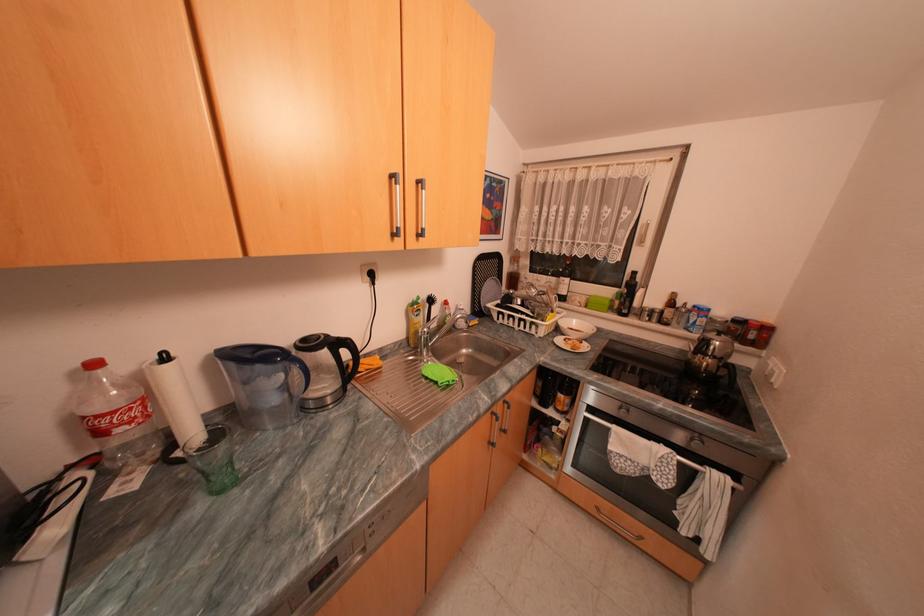
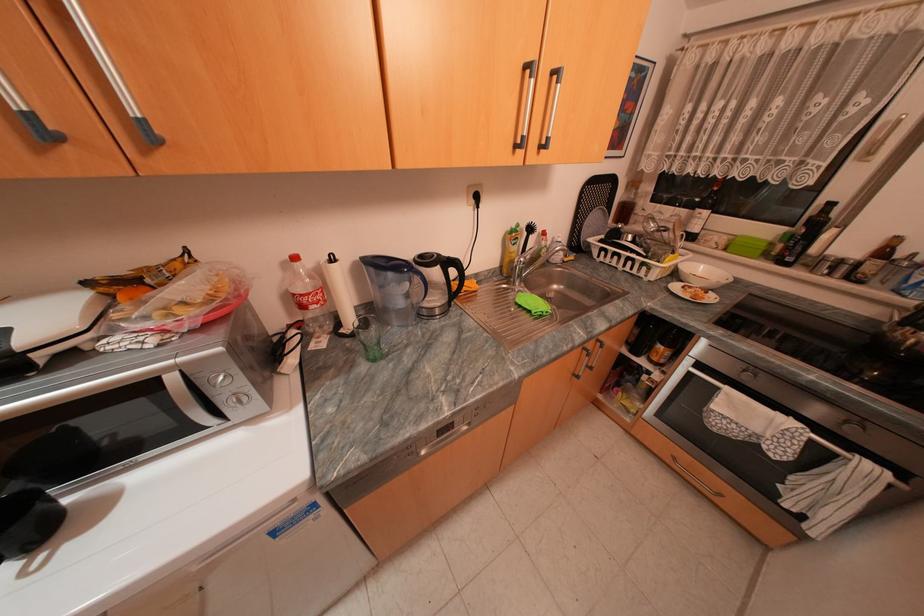
In the second image, find the point that corresponds to point (507, 408) in the first image.

(599, 345)